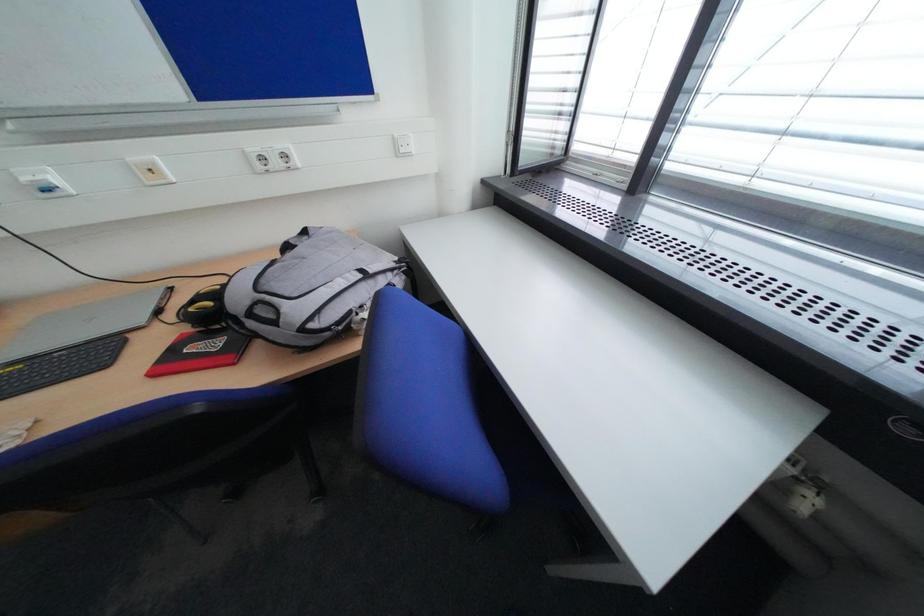
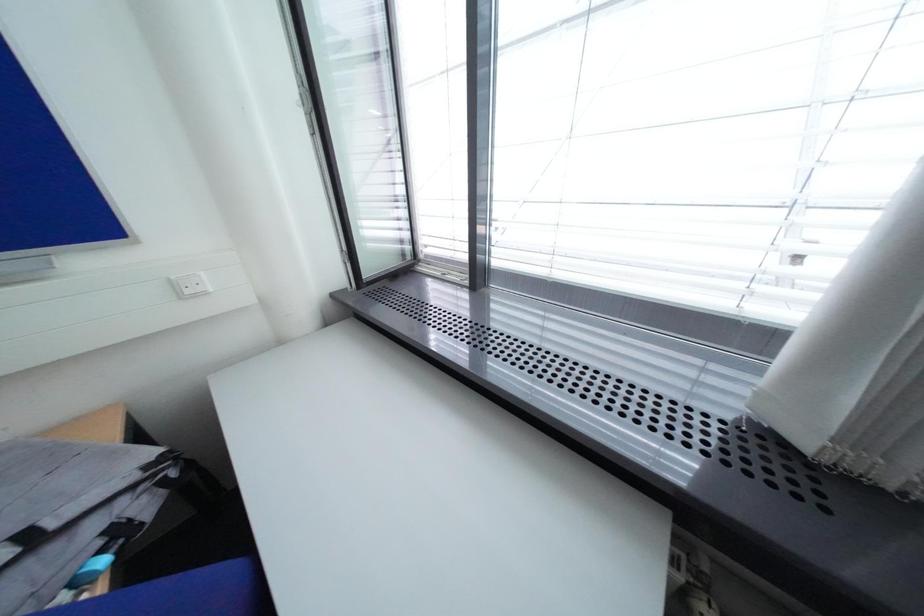
Question: What movement of the cameraman would produce the second image?

Choices:
 (A) Left
 (B) Right
 (C) Forward
 (D) Backward

Answer: (B)